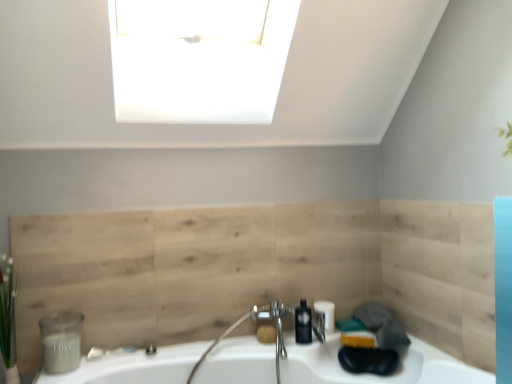
Question: Is matte gray container at lower left, the second toiletry in the back-to-front sequence, to the left or to the right of polished chrome faucet at center in the image?

Choices:
 (A) left
 (B) right

Answer: (A)

Question: In terms of size, does matte gray container at lower left, the second toiletry in the back-to-front sequence, appear bigger or smaller than polished chrome faucet at center?

Choices:
 (A) small
 (B) big

Answer: (A)

Question: Estimate the real-world distances between objects in this image. Which object is closer to the black matte soap dispenser at center?

Choices:
 (A) white glossy sink at lower center
 (B) matte black toiletry at lower center, the first toiletry viewed from the right
 (C) matte gray container at lower left, marked as the first toiletry in a left-to-right arrangement
 (D) polished chrome faucet at center
 (E) green leafy plant at left

Answer: (B)

Question: Estimate the real-world distances between objects in this image. Which object is closer to the green leafy plant at left?

Choices:
 (A) black matte soap dispenser at center
 (B) polished chrome faucet at center
 (C) matte brown soap at center
 (D) matte gray container at lower left, the 1th toiletry when ordered from front to back
 (E) natural wood paneling at center

Answer: (D)